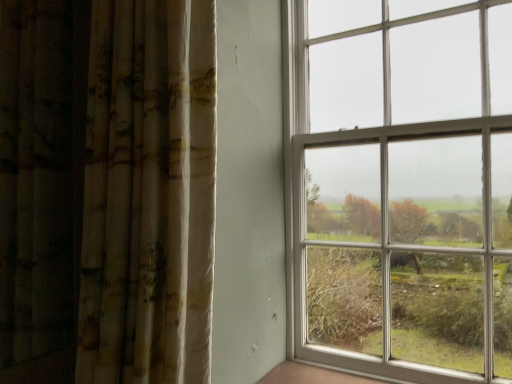
What do you see at coordinates (106, 190) in the screenshot? The image size is (512, 384). I see `printed fabric curtain at left` at bounding box center [106, 190].

This screenshot has height=384, width=512. I want to click on printed fabric curtain at left, so click(x=106, y=190).

Where is `printed fabric curtain at left`? The width and height of the screenshot is (512, 384). printed fabric curtain at left is located at coordinates (106, 190).